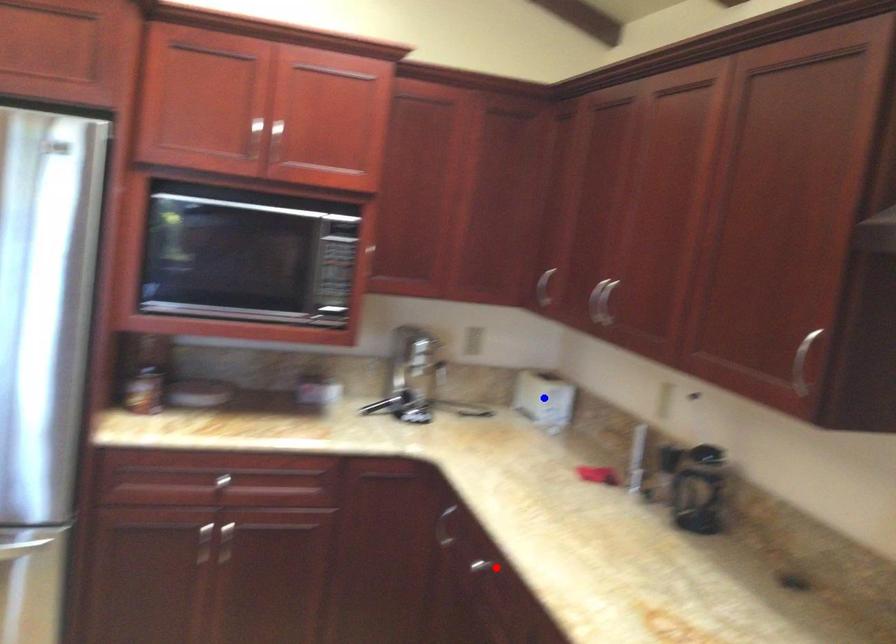
Question: Which of the two points in the image is closer to the camera?

Choices:
 (A) Blue point is closer.
 (B) Red point is closer.

Answer: (B)